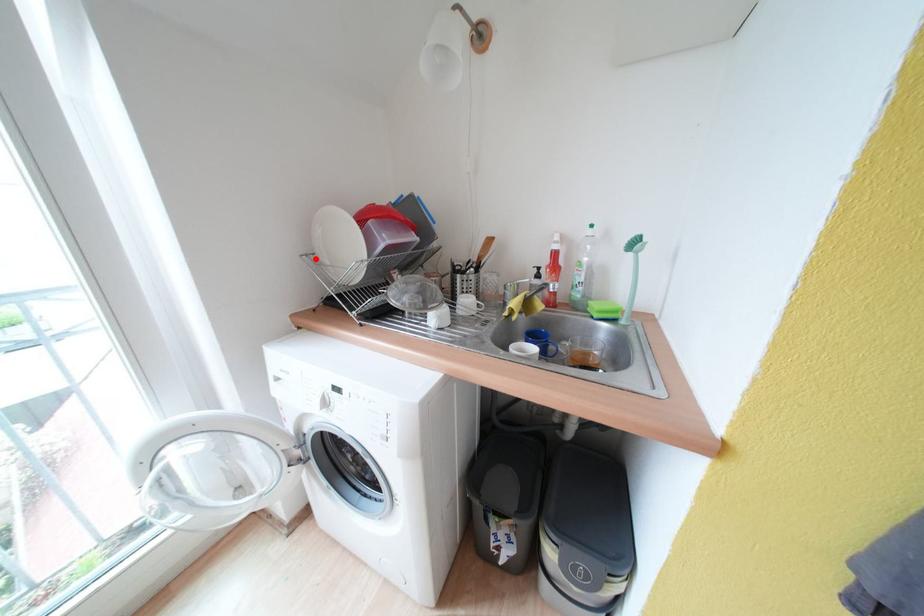
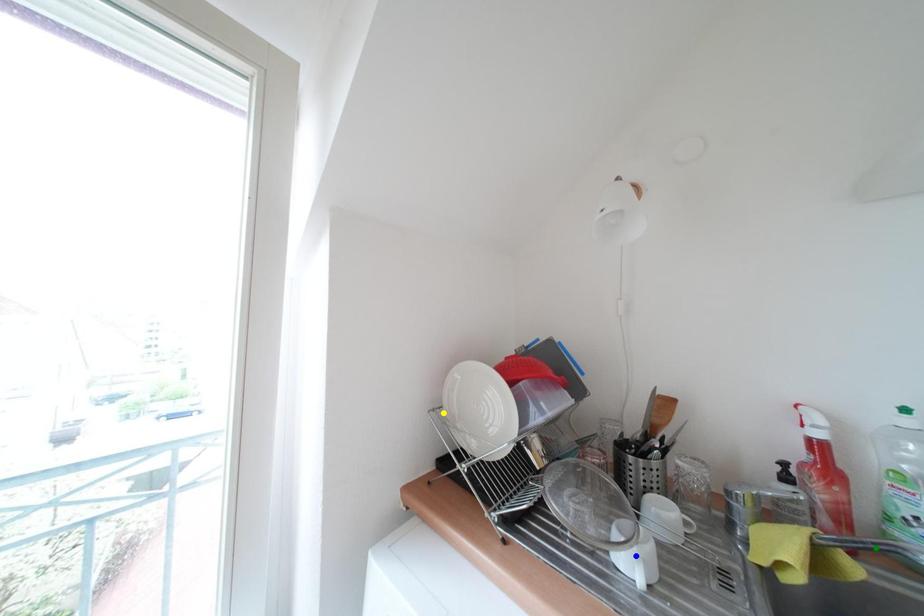
Question: I am providing you with two images of the same scene from different viewpoints. A red point is marked on the first image. You are given multiple points on the second image. Which mark in image 2 goes with the point in image 1?

Choices:
 (A) green point
 (B) yellow point
 (C) blue point

Answer: (B)